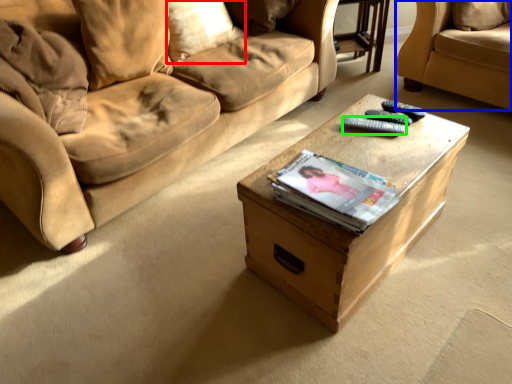
Question: Considering the real-world distances, which object is farthest from pillow (highlighted by a red box)? studio couch (highlighted by a blue box) or remote (highlighted by a green box)?

Choices:
 (A) studio couch
 (B) remote

Answer: (A)